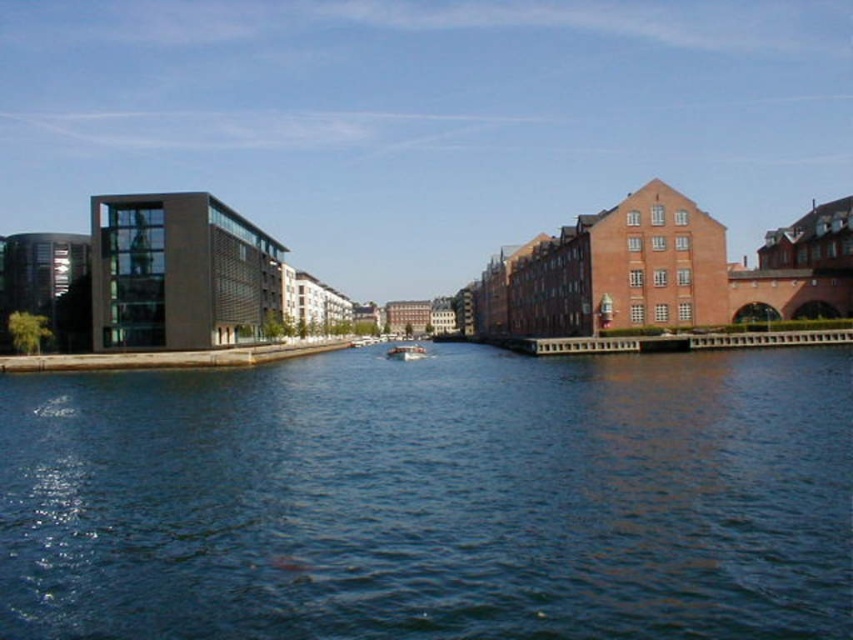
Question: Which object is closer to the camera taking this photo?

Choices:
 (A) dark blue water at center
 (B) white plastic boat at center

Answer: (A)

Question: Which object is closer to the camera taking this photo?

Choices:
 (A) dark blue water at center
 (B) white plastic boat at center

Answer: (A)

Question: Which of the following is the farthest from the observer?

Choices:
 (A) (424, 355)
 (B) (154, 433)

Answer: (A)

Question: Can you confirm if dark blue water at center is positioned below white plastic boat at center?

Choices:
 (A) yes
 (B) no

Answer: (A)

Question: Does dark blue water at center appear over white plastic boat at center?

Choices:
 (A) yes
 (B) no

Answer: (B)

Question: Can you confirm if dark blue water at center is bigger than white plastic boat at center?

Choices:
 (A) yes
 (B) no

Answer: (A)